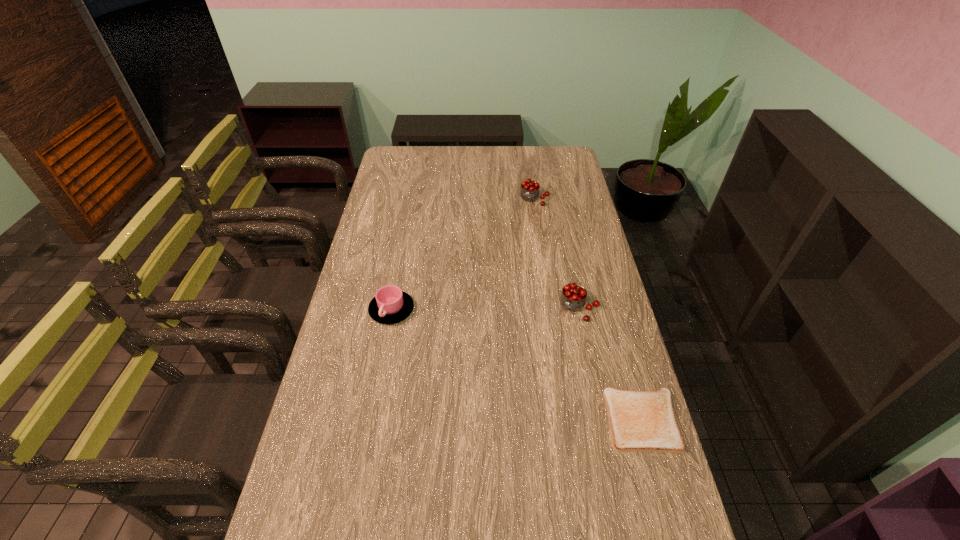
Where is `unoccupied position between the nearer pot filled with cherries and the leftmost object`? unoccupied position between the nearer pot filled with cherries and the leftmost object is located at coordinates (485, 309).

Identify the location of free space that is in between the nearest object and the nearer pot filled with cherries. (610, 364).

The width and height of the screenshot is (960, 540). Find the location of `free space between the nearest object and the nearer pot filled with cherries`. free space between the nearest object and the nearer pot filled with cherries is located at coordinates [610, 364].

You are a GUI agent. You are given a task and a screenshot of the screen. Output one action in this format:
    pyautogui.click(x=<x>, y=<y>)
    Task: Click on the vacant area that lies between the farthest object and the cup
    The image size is (960, 540).
    Given the screenshot: What is the action you would take?
    pyautogui.click(x=463, y=254)

The height and width of the screenshot is (540, 960). I want to click on empty space that is in between the farther pot filled with cherries and the second shortest object, so click(x=463, y=254).

Identify the location of empty space between the toast and the nearer pot filled with cherries. (610, 364).

Image resolution: width=960 pixels, height=540 pixels. Identify the location of vacant space in between the shortest object and the cup. (517, 365).

Where is `free area in between the farthest object and the cup`? The height and width of the screenshot is (540, 960). free area in between the farthest object and the cup is located at coordinates (463, 254).

This screenshot has width=960, height=540. In order to click on free space between the shortest object and the nearer pot filled with cherries in this screenshot , I will do `click(610, 364)`.

Select which object is the closest to the leftmost object. Please provide its 2D coordinates. Your answer should be formatted as a tuple, i.e. [(x, y)], where the tuple contains the x and y coordinates of a point satisfying the conditions above.

[(573, 298)]